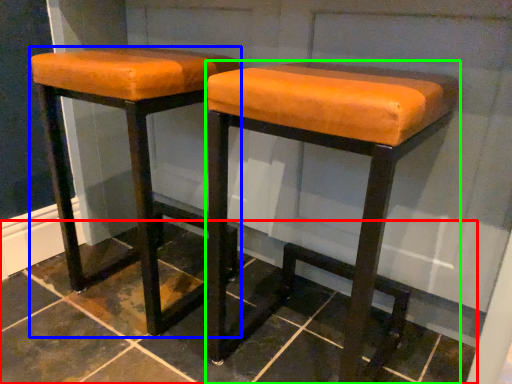
Question: Which object is positioned farthest from tile (highlighted by a red box)? Select from stool (highlighted by a blue box) and stool (highlighted by a green box).

Choices:
 (A) stool
 (B) stool

Answer: (B)